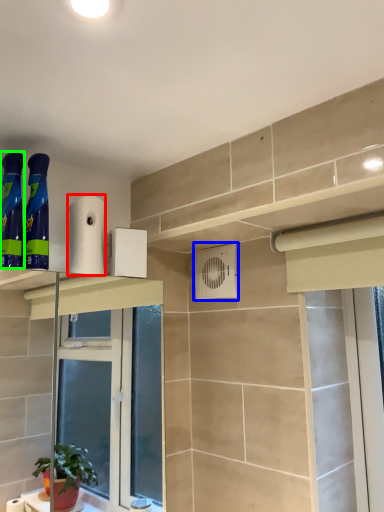
Question: Based on their relative distances, which object is farther from toilet paper (highlighted by a red box)? Choose from air conditioning (highlighted by a blue box) and cleaning product (highlighted by a green box).

Choices:
 (A) air conditioning
 (B) cleaning product

Answer: (A)